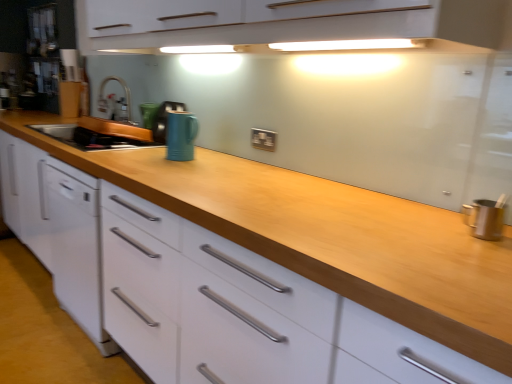
Question: In terms of height, does matte blue mug at center, which is the third appliance in back-to-front order, look taller or shorter compared to black plastic electric outlet at center?

Choices:
 (A) tall
 (B) short

Answer: (A)

Question: Is matte blue mug at center, which is the third appliance in back-to-front order, in front of or behind black plastic electric outlet at center in the image?

Choices:
 (A) behind
 (B) front

Answer: (B)

Question: Which is nearer to the wooden at center?

Choices:
 (A) white glossy dishwasher at left
 (B) satin nickel faucet at center
 (C) matte blue mug at center, positioned as the first appliance in front-to-back order
 (D) green ceramic mug at upper center, the 3th appliance in the front-to-back sequence
 (E) metallic silver utensil holder at right

Answer: (C)

Question: Considering the real-world distances, which object is closest to the metallic silver utensil holder at right?

Choices:
 (A) black plastic electric outlet at center
 (B) wooden at center
 (C) matte blue mug at center, positioned as the first appliance in front-to-back order
 (D) satin nickel faucet at center
 (E) green ceramic mug at upper center, the 1th appliance in the back-to-front sequence

Answer: (B)